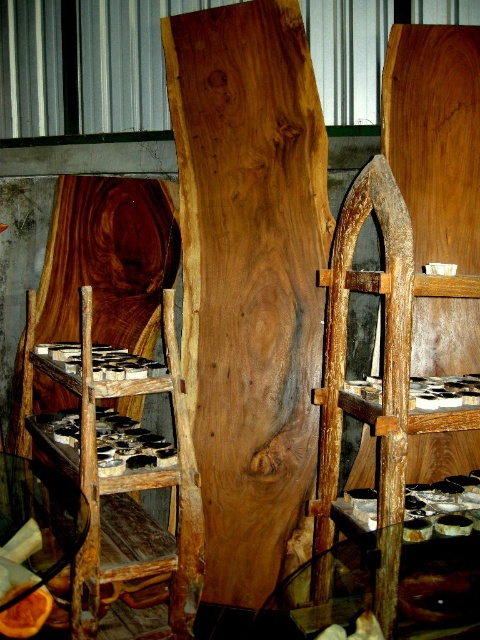
Who is lower down, natural wood plank at center or rusty wood chair at left?

Positioned lower is rusty wood chair at left.

Looking at this image, measure the distance between point [252,374] and camera.

8.16 feet

Measure the distance between point (238,600) and camera.

8.13 feet

Locate an element on the screen. The width and height of the screenshot is (480, 640). natural wood plank at center is located at coordinates (250, 280).

Is natural wood plank at center positioned before rustic wood ladder at center?

No, natural wood plank at center is behind rustic wood ladder at center.

Is point (288, 525) positioned in front of point (391, 618)?

That is False.

Identify the location of natural wood plank at center. (250, 280).

Can you confirm if rusty wood chair at left is shorter than rustic wood ladder at center?

Yes, rusty wood chair at left is shorter than rustic wood ladder at center.

Looking at this image, between rusty wood chair at left and rustic wood ladder at center, which one is positioned higher?

rustic wood ladder at center is above.

What do you see at coordinates (120, 474) in the screenshot?
I see `rusty wood chair at left` at bounding box center [120, 474].

Identify the location of rusty wood chair at left. This screenshot has height=640, width=480. (120, 474).